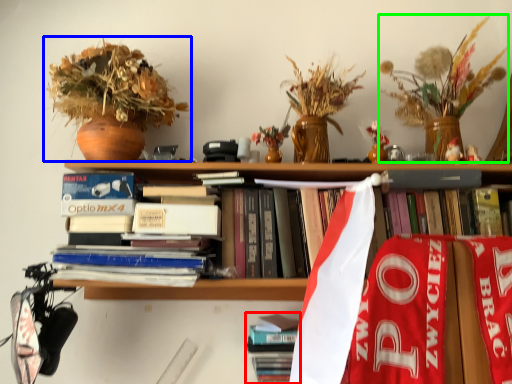
Question: Estimate the real-world distances between objects in this image. Which object is closer to book (highlighted by a red box), houseplant (highlighted by a blue box) or floral arrangement (highlighted by a green box)?

Choices:
 (A) houseplant
 (B) floral arrangement

Answer: (A)